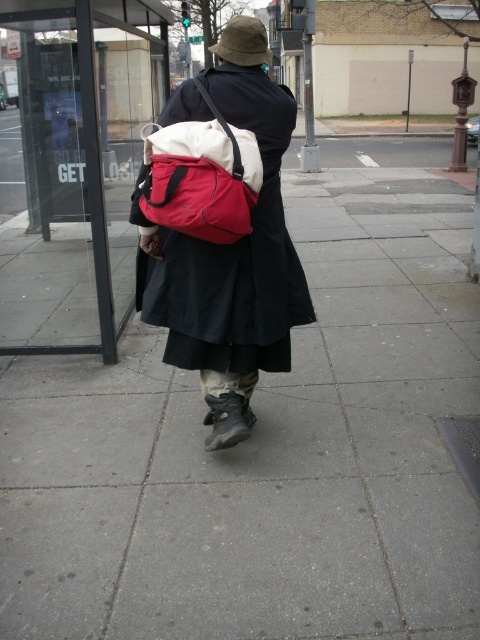
Question: Which object is farther from the camera taking this photo?

Choices:
 (A) black matte robe at center
 (B) matte nylon backpack at center
 (C) gray concrete sidewalk at center

Answer: (A)

Question: Does black matte robe at center appear on the left side of matte nylon backpack at center?

Choices:
 (A) yes
 (B) no

Answer: (A)

Question: Where is gray concrete sidewalk at center located in relation to transparent glass bus stop at upper center in the image?

Choices:
 (A) above
 (B) below

Answer: (B)

Question: From the image, what is the correct spatial relationship of transparent glass bus stop at upper center in relation to black matte robe at center?

Choices:
 (A) below
 (B) above

Answer: (B)

Question: Which point is farther to the camera?

Choices:
 (A) matte nylon backpack at center
 (B) black matte robe at center
 (C) gray concrete sidewalk at center
 (D) transparent glass bus stop at upper center

Answer: (D)

Question: Which point is closer to the camera?

Choices:
 (A) matte nylon backpack at center
 (B) gray concrete sidewalk at center
 (C) transparent glass bus stop at upper center
 (D) black matte robe at center

Answer: (B)